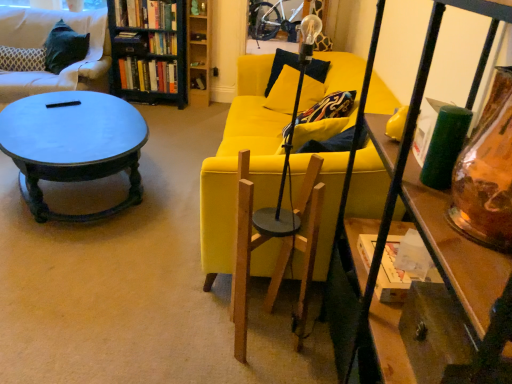
Identify the location of free space that is in between wooden bookshelf at center and black painted wood bookcase at upper left. The image size is (512, 384). (199, 105).